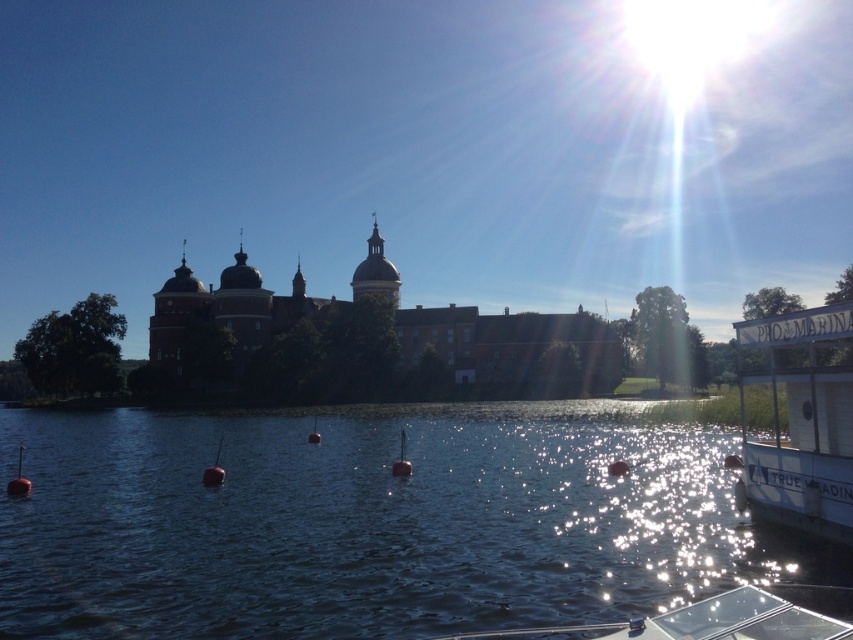
Consider the image. You are a drone operator trying to navigate between two points marked in the image. The first point is at coordinates point (445, 481) and the second is at point (9, 486). According to the scene, which point is closer to the historic building in the midground?

Point (9, 486) is closer to the historic building in the midground because it is in front of point (445, 481), which is behind it.

You are planning to sail a small toy boat that is 1 meter long. You see the dark blue water at center and the white matte boat at right in the image. Which object can accommodate your toy boat in terms of size?

The dark blue water at center is larger in size than the white matte boat at right, so the dark blue water at center can accommodate the toy boat.